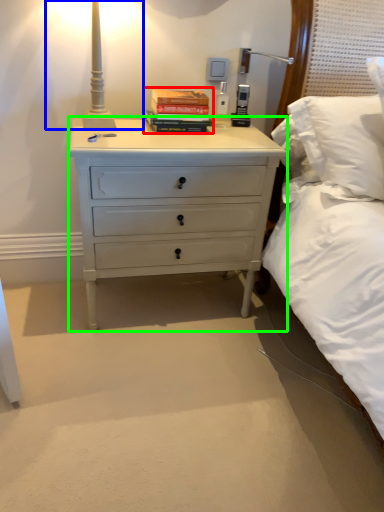
Question: Estimate the real-world distances between objects in this image. Which object is closer to paperback book (highlighted by a red box), bedside lamp (highlighted by a blue box) or chest of drawers (highlighted by a green box)?

Choices:
 (A) bedside lamp
 (B) chest of drawers

Answer: (A)